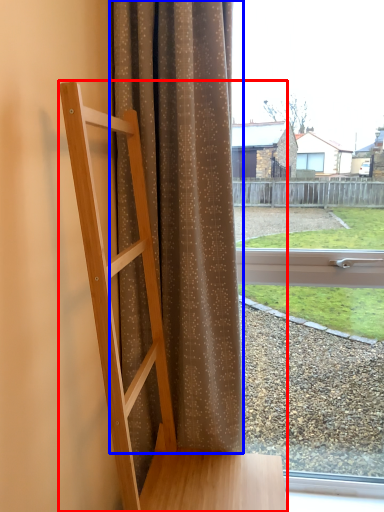
Question: Which object is closer to the camera taking this photo, furniture (highlighted by a red box) or curtain (highlighted by a blue box)?

Choices:
 (A) furniture
 (B) curtain

Answer: (A)